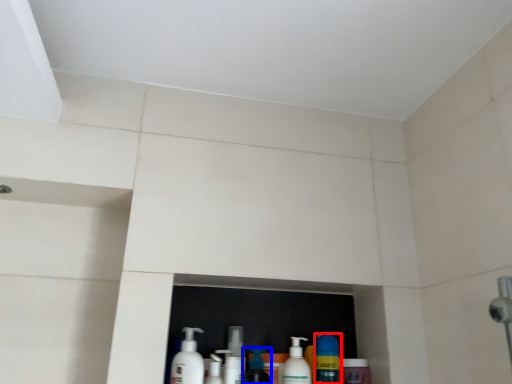
Question: Which object is closer to the camera taking this photo, cleaning product (highlighted by a red box) or cleaning product (highlighted by a blue box)?

Choices:
 (A) cleaning product
 (B) cleaning product

Answer: (B)